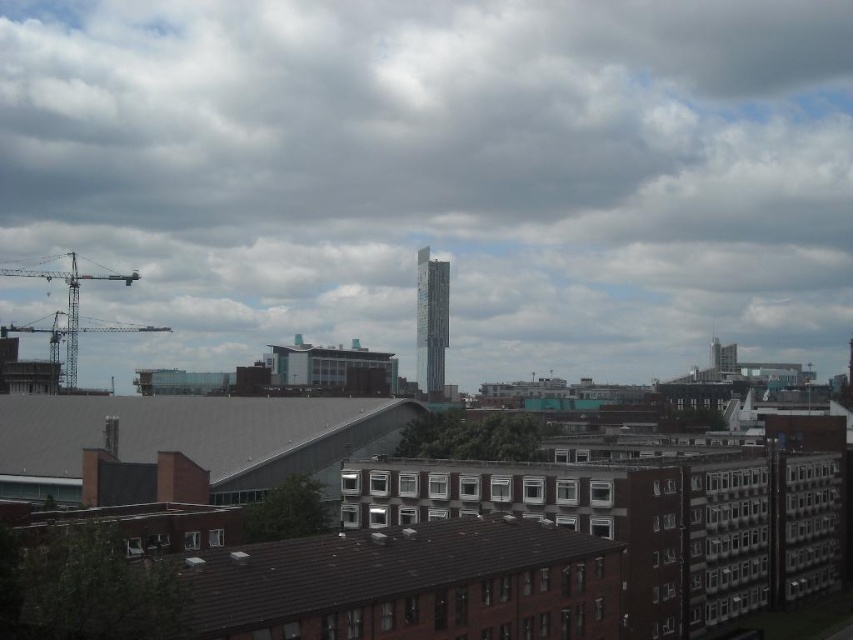
I want to click on white fluffy cloud at upper center, so click(x=438, y=177).

Which is below, white fluffy cloud at upper center or silver glass tower at center?

silver glass tower at center

Identify the location of white fluffy cloud at upper center. (438, 177).

Find the location of a particular element. This screenshot has height=640, width=853. white fluffy cloud at upper center is located at coordinates click(438, 177).

Who is higher up, white fluffy cloud at upper center or metallic gray crane at left?

white fluffy cloud at upper center is higher up.

Which of these two, white fluffy cloud at upper center or metallic gray crane at left, stands taller?

white fluffy cloud at upper center is taller.

This screenshot has width=853, height=640. What do you see at coordinates (438, 177) in the screenshot?
I see `white fluffy cloud at upper center` at bounding box center [438, 177].

Image resolution: width=853 pixels, height=640 pixels. What are the coordinates of `white fluffy cloud at upper center` in the screenshot? It's located at (438, 177).

Is point (567, 616) behind point (74, 304)?

No, (567, 616) is closer to viewer.

You are a GUI agent. You are given a task and a screenshot of the screen. Output one action in this format:
    pyautogui.click(x=<x>, y=<y>)
    Task: Click on the gray concrete construction site at center
    
    Given the screenshot: What is the action you would take?
    coord(425,522)